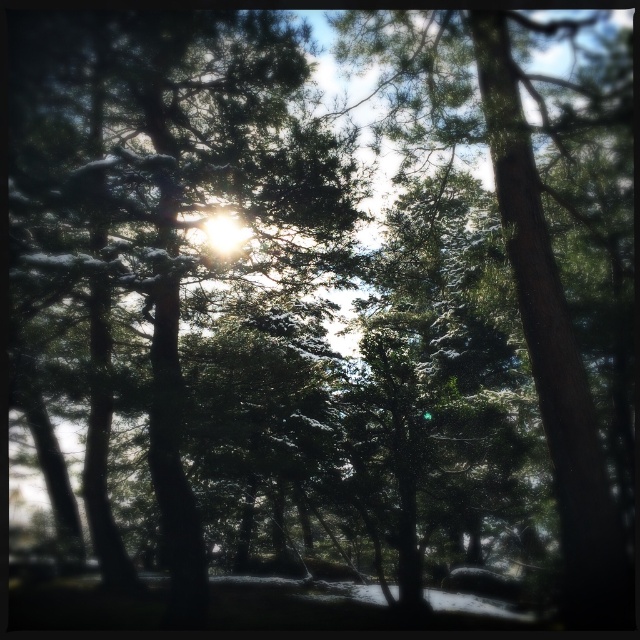
Question: Does green matte tree at center have a lesser width compared to green textured tree at center?

Choices:
 (A) no
 (B) yes

Answer: (A)

Question: Is green matte tree at center smaller than green textured tree at center?

Choices:
 (A) no
 (B) yes

Answer: (A)

Question: Which object is farther from the camera taking this photo?

Choices:
 (A) green matte tree at center
 (B) green textured tree at center

Answer: (A)

Question: Is green matte tree at center positioned in front of green textured tree at center?

Choices:
 (A) no
 (B) yes

Answer: (A)